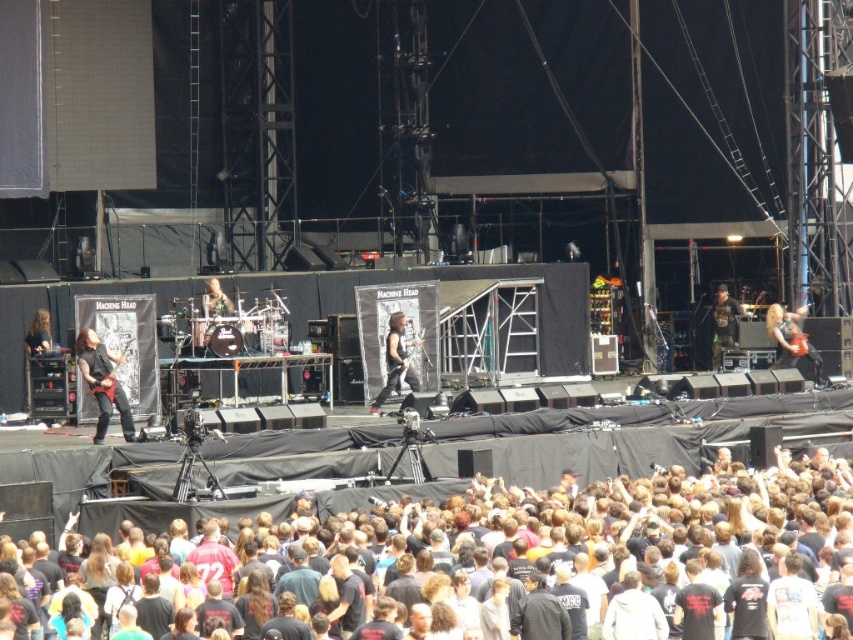
Question: From the image, what is the correct spatial relationship of black cotton crowd at lower center in relation to matte black guitar at center?

Choices:
 (A) below
 (B) above

Answer: (A)

Question: Is shiny red guitar at right below camouflage jacket at right?

Choices:
 (A) yes
 (B) no

Answer: (A)

Question: Which point is farther to the camera?

Choices:
 (A) matte black guitar at center
 (B) shiny black guitar at left
 (C) shiny red guitar at right
 (D) camouflage jacket at right

Answer: (D)

Question: Which point is closer to the camera taking this photo?

Choices:
 (A) (509, 554)
 (B) (383, 387)
 (C) (737, 317)

Answer: (A)

Question: Observing the image, what is the correct spatial positioning of shiny black guitar at left in reference to matte black guitar at center?

Choices:
 (A) below
 (B) above

Answer: (A)

Question: Which object is the closest to the shiny black guitar at left?

Choices:
 (A) shiny black guitar at center
 (B) black cotton crowd at lower center
 (C) camouflage jacket at right
 (D) matte black guitar at center

Answer: (D)